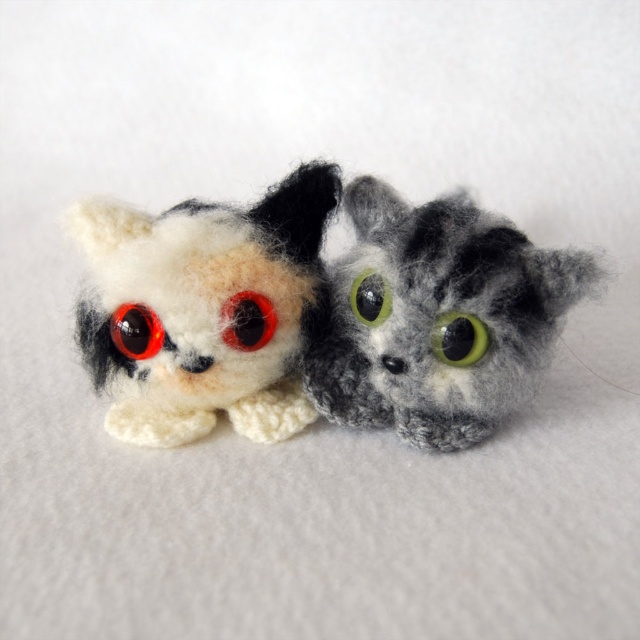
You are an interior designer arranging a shelf display. You have a white woolen cat at left and a green fuzzy eye at center. Which object should you place higher on the shelf to ensure both are visible?

The white woolen cat at left is taller than the green fuzzy eye at center, so placing the white woolen cat at left lower and the green fuzzy eye at center higher would ensure both are visible without one blocking the other.

You are an artist looking to sketch the arrangement of the two plush toys in the image. You notice the white woolen cat at left and the red felt eye at center. Which object is positioned higher in the image?

The white woolen cat at left is located above the red felt eye at center, so it is positioned higher in the image.